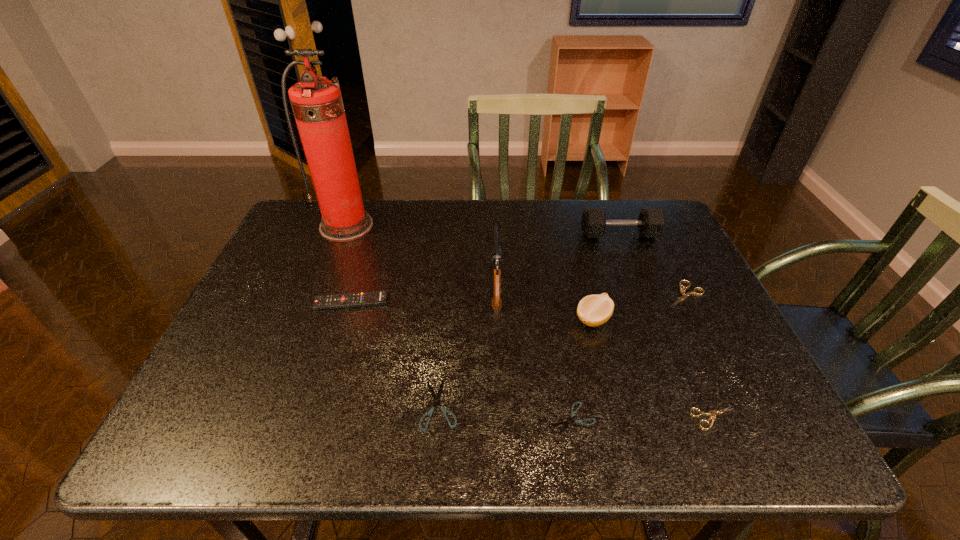
The height and width of the screenshot is (540, 960). I want to click on object identified as the fifth closest to the third tallest object, so click(x=713, y=412).

This screenshot has width=960, height=540. I want to click on the second closest shears to the shortest shears, so click(x=713, y=412).

Where is `shears object that ranks as the fourth closest to the fire extinguisher`? This screenshot has width=960, height=540. shears object that ranks as the fourth closest to the fire extinguisher is located at coordinates (713, 412).

Where is `free space that satisfies the following two spatial constraints: 1. at the discharge end of the tallest object; 2. on the left side of the remote control`? The height and width of the screenshot is (540, 960). free space that satisfies the following two spatial constraints: 1. at the discharge end of the tallest object; 2. on the left side of the remote control is located at coordinates (317, 302).

I want to click on vacant space that satisfies the following two spatial constraints: 1. on the back side of the smaller black shears; 2. on the right side of the smaller beige shears, so click(572, 418).

I want to click on vacant region that satisfies the following two spatial constraints: 1. at the discharge end of the fire extinguisher; 2. on the right side of the leftmost shears, so click(277, 405).